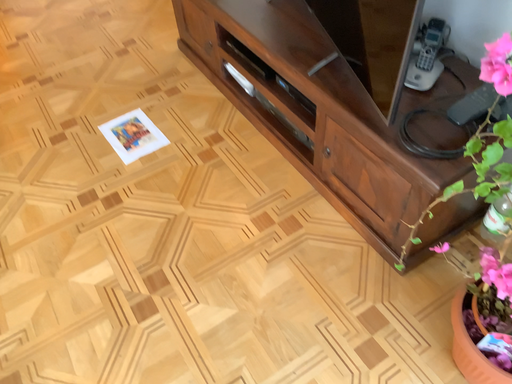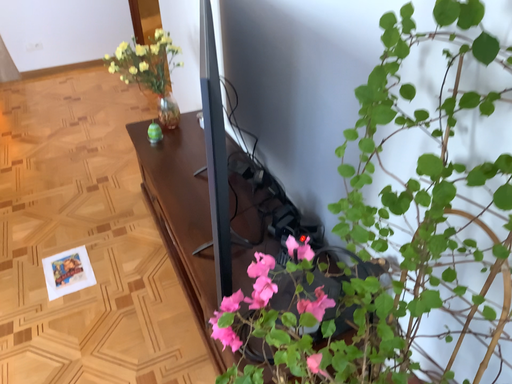
Question: How did the camera likely rotate when shooting the video?

Choices:
 (A) rotated downward
 (B) rotated upward

Answer: (B)